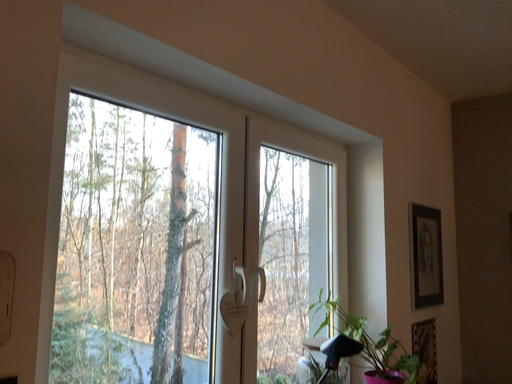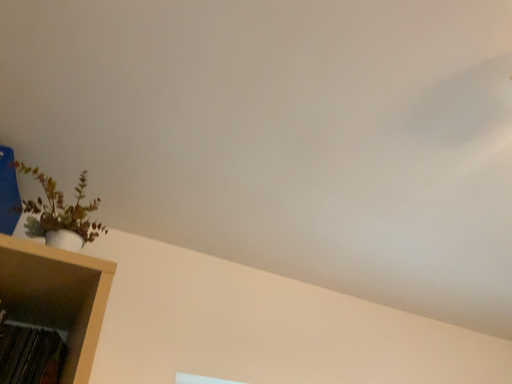
Question: Which way did the camera rotate in the video?

Choices:
 (A) rotated right
 (B) rotated left

Answer: (B)